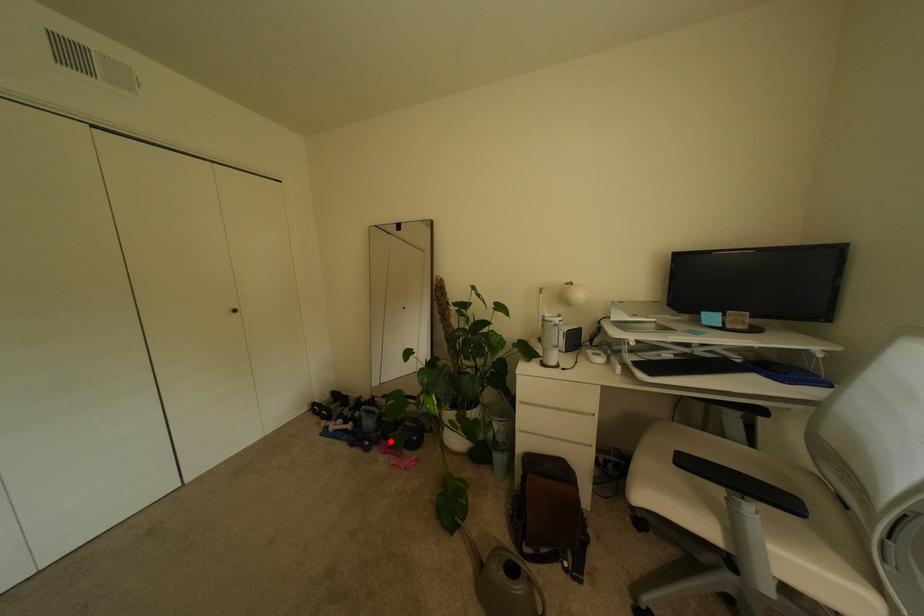
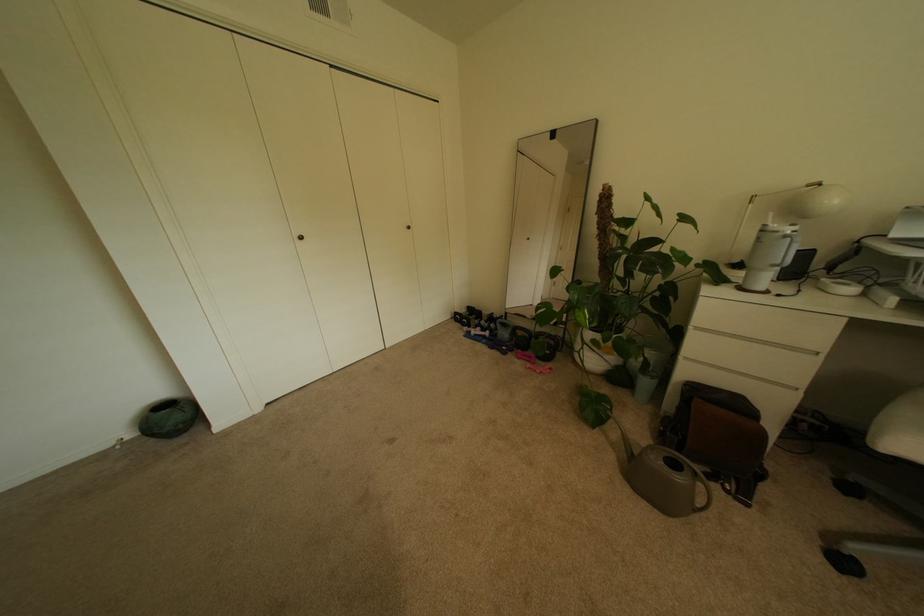
Where in the second image is the point corresponding to the highlighted location from the first image?

(524, 350)